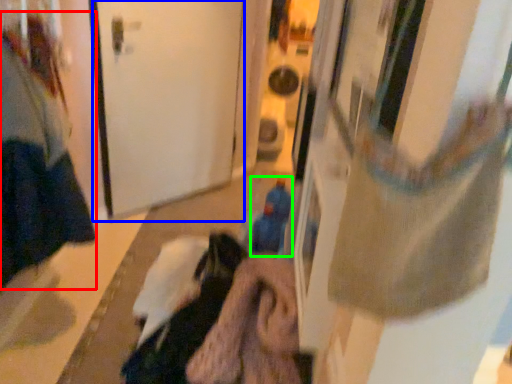
Question: Based on their relative distances, which object is nearer to woman (highlighted by a red box)? Choose from door (highlighted by a blue box) and toy (highlighted by a green box).

Choices:
 (A) door
 (B) toy

Answer: (A)